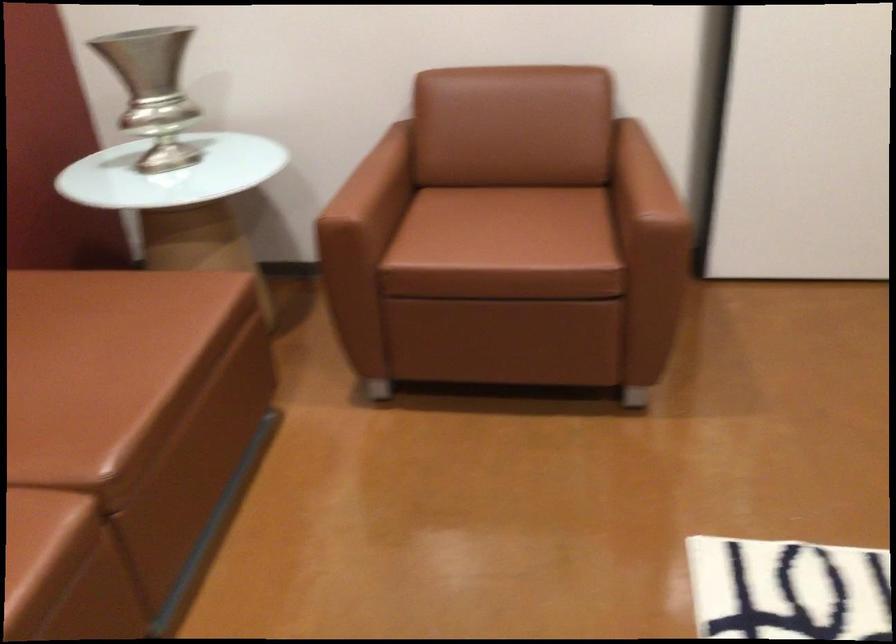
Where would you sit the brown sofa surface? Please return your answer as a coordinate pair (x, y).

(497, 228)